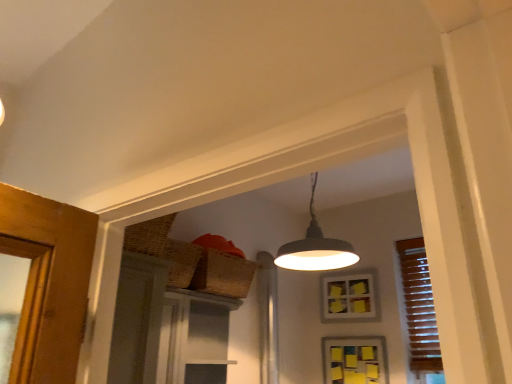
Question: Considering the relative sizes of matte gray lampshade at upper center and matte gray screen door at center in the image provided, is matte gray lampshade at upper center shorter than matte gray screen door at center?

Choices:
 (A) no
 (B) yes

Answer: (A)

Question: Is the position of matte gray lampshade at upper center more distant than that of matte gray screen door at center?

Choices:
 (A) no
 (B) yes

Answer: (A)

Question: From the image's perspective, would you say matte gray lampshade at upper center is shown under matte gray screen door at center?

Choices:
 (A) no
 (B) yes

Answer: (A)

Question: Is matte gray lampshade at upper center not close to matte gray screen door at center?

Choices:
 (A) yes
 (B) no

Answer: (B)

Question: Does matte gray lampshade at upper center touch matte gray screen door at center?

Choices:
 (A) yes
 (B) no

Answer: (B)

Question: Considering their positions, is yellow paper at upper center, which is the second window in top-to-bottom order, located in front of or behind matte gray screen door at center?

Choices:
 (A) front
 (B) behind

Answer: (B)

Question: From their relative heights in the image, would you say yellow paper at upper center, the 1th window in the bottom-to-top sequence, is taller or shorter than matte gray screen door at center?

Choices:
 (A) tall
 (B) short

Answer: (B)

Question: Is point (358, 339) positioned closer to the camera than point (202, 299)?

Choices:
 (A) closer
 (B) farther

Answer: (B)

Question: From the image's perspective, is yellow paper at upper center, which is the second window in top-to-bottom order, above or below matte gray screen door at center?

Choices:
 (A) below
 (B) above

Answer: (A)

Question: Based on their positions, is matte gray lampshade at upper center located to the left or right of matte gray screen door at center?

Choices:
 (A) right
 (B) left

Answer: (A)

Question: In terms of size, does matte gray lampshade at upper center appear bigger or smaller than matte gray screen door at center?

Choices:
 (A) big
 (B) small

Answer: (A)

Question: In terms of width, does matte gray lampshade at upper center look wider or thinner when compared to matte gray screen door at center?

Choices:
 (A) wide
 (B) thin

Answer: (A)

Question: Considering the positions of matte gray lampshade at upper center and matte gray screen door at center in the image, is matte gray lampshade at upper center taller or shorter than matte gray screen door at center?

Choices:
 (A) tall
 (B) short

Answer: (A)

Question: In terms of height, does matte gray lampshade at upper center look taller or shorter compared to yellow paper at upper center, which is the second window in top-to-bottom order?

Choices:
 (A) tall
 (B) short

Answer: (A)

Question: Based on their sizes in the image, would you say matte gray lampshade at upper center is bigger or smaller than yellow paper at upper center, the 1th window in the bottom-to-top sequence?

Choices:
 (A) small
 (B) big

Answer: (B)